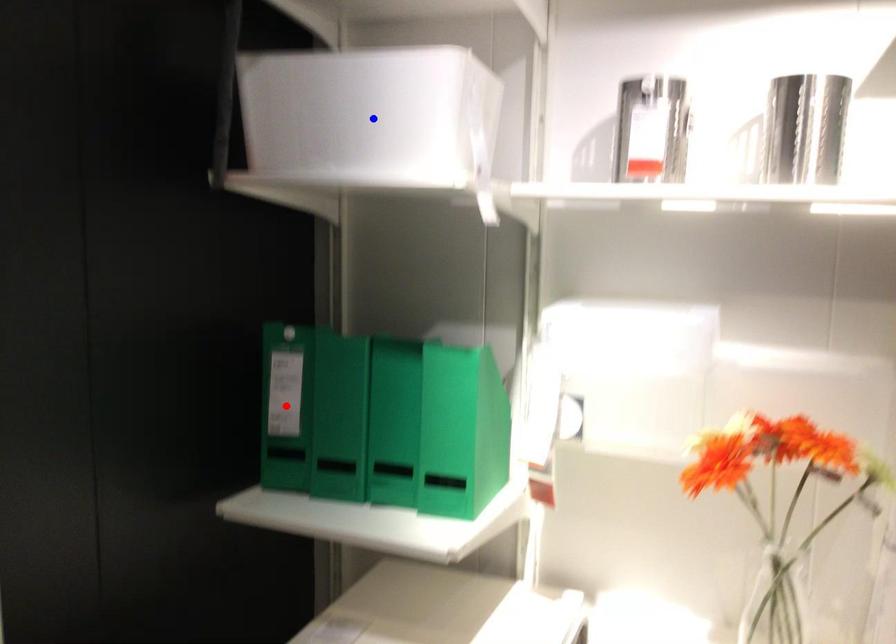
Question: Two points are marked on the image. Which point is closer to the camera?

Choices:
 (A) Blue point is closer.
 (B) Red point is closer.

Answer: (A)